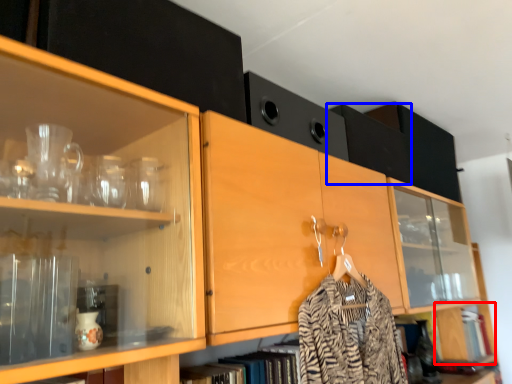
Question: Which point is further to the camera, cabinetry (highlighted by a red box) or cabinetry (highlighted by a blue box)?

Choices:
 (A) cabinetry
 (B) cabinetry

Answer: (A)